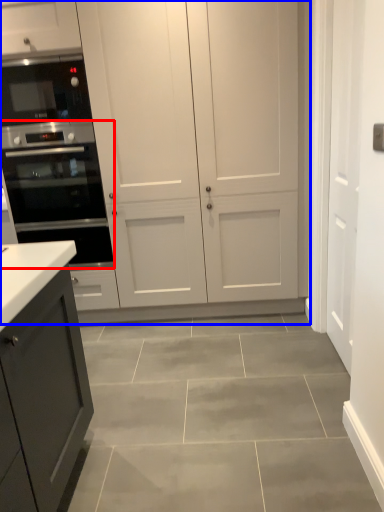
Question: Which of the following is the closest to the observer, oven (highlighted by a red box) or cupboard (highlighted by a blue box)?

Choices:
 (A) oven
 (B) cupboard

Answer: (B)